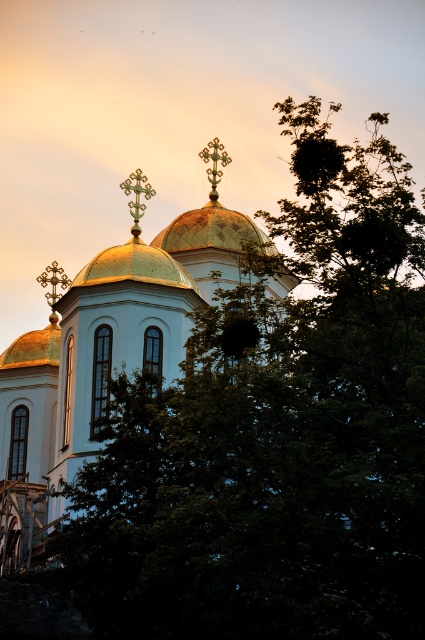
You are a photographer aiming to capture the golden elements of the church. You notice the gold polished dome at center and the gold metallic cross at center. Which object is located below the other in the scene?

The gold polished dome at center is positioned under the gold metallic cross at center, so the dome is below the cross.

You are standing in front of the church and notice the gold polished dome at center and the gold metallic cross at center. Which object is closer to you?

The gold polished dome at center is closer to you because it is in front of the gold metallic cross at center.

You are standing in a park and see the gold domed church at center and the gold polished dome at upper left. Which one is positioned more to the east if the sun is setting in the west?

The gold polished dome at upper left is positioned more to the east because it is to the left of the gold domed church at center, and since the sun is setting in the west, the eastern side would be on the left side of the image.